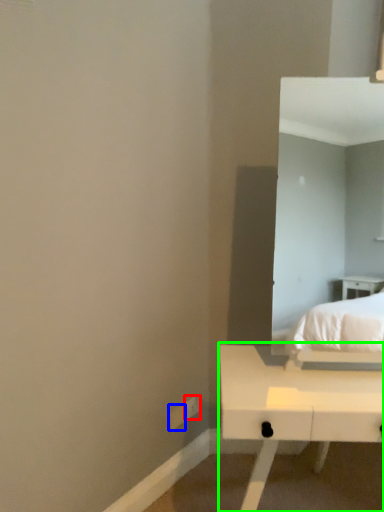
Question: Which object is positioned farthest from electric outlet (highlighted by a red box)? Select from electric outlet (highlighted by a blue box) and table (highlighted by a green box).

Choices:
 (A) electric outlet
 (B) table

Answer: (B)